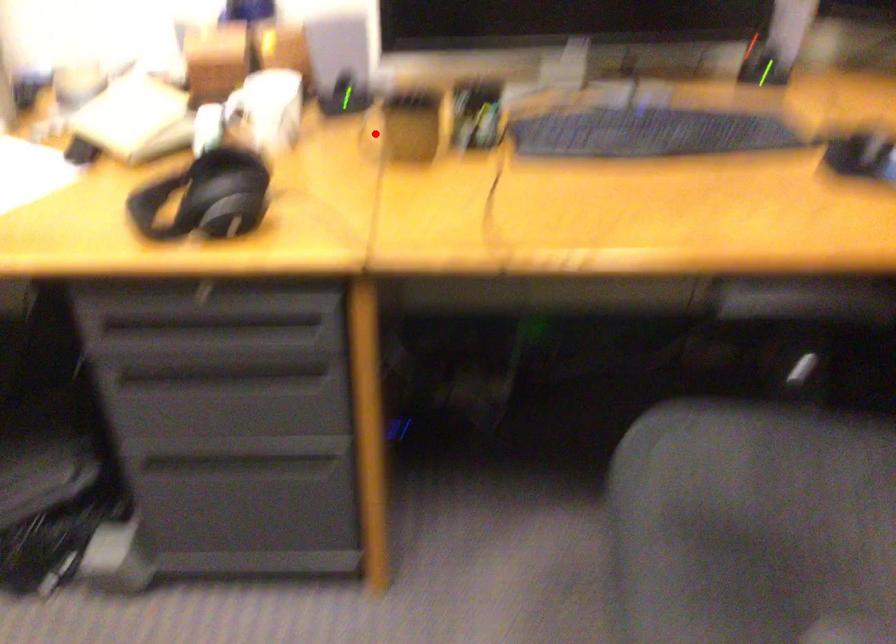
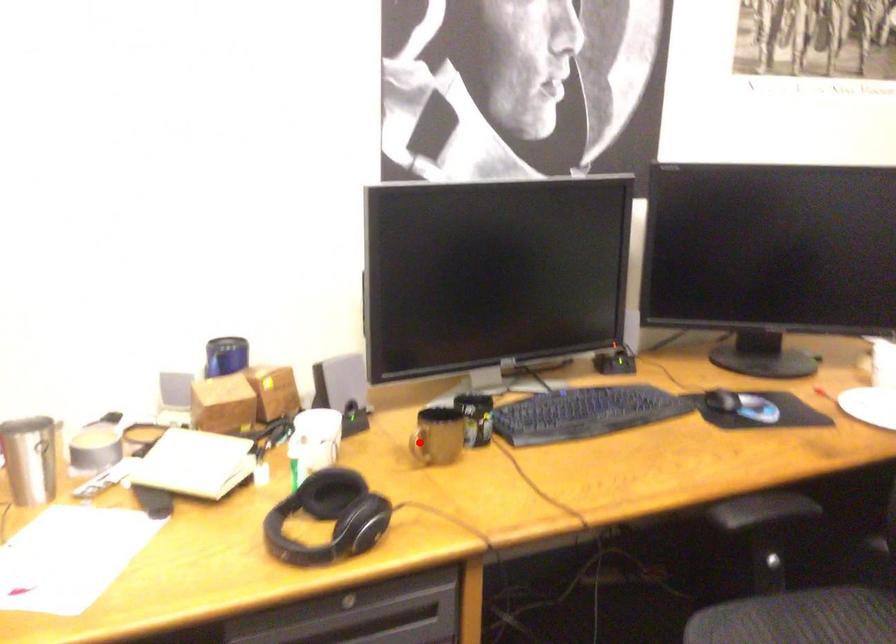
I am providing you with two images of the same scene from different viewpoints. A red point is marked on the first image and another point is marked on the second image. Is the marked point in image1 the same physical position as the marked point in image2?

Yes